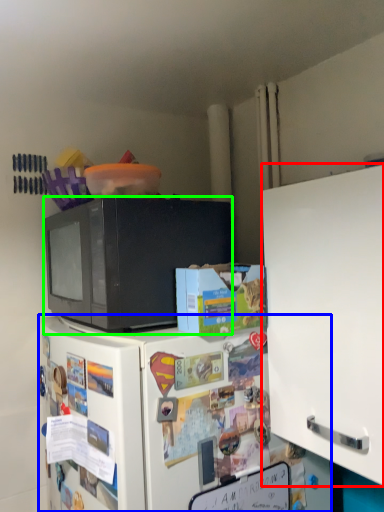
Question: Considering the real-world distances, which object is closest to cabinetry (highlighted by a red box)? refrigerator (highlighted by a blue box) or microwave oven (highlighted by a green box).

Choices:
 (A) refrigerator
 (B) microwave oven

Answer: (A)